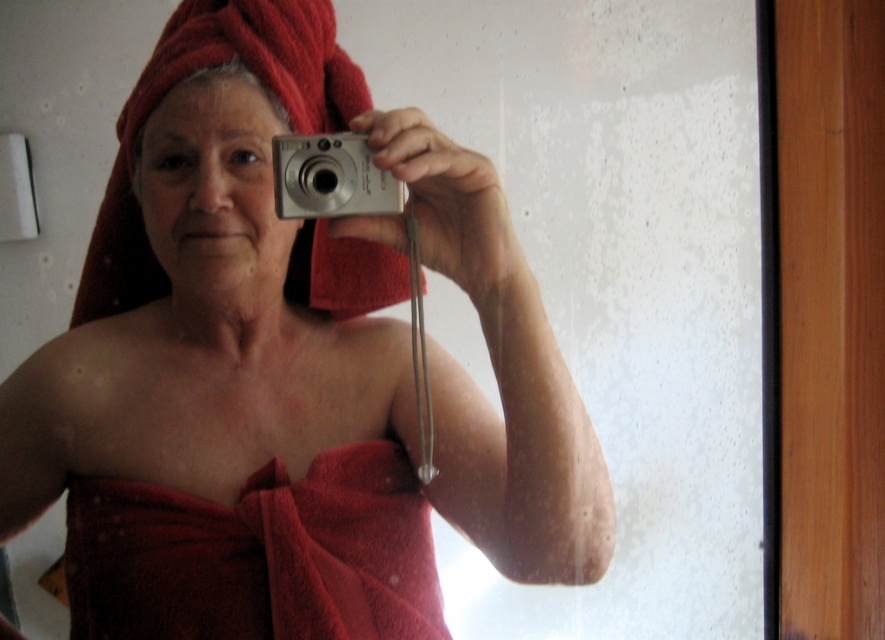
Between point (314, 481) and point (317, 157), which one is positioned behind?

The point (314, 481) is more distant.

Image resolution: width=885 pixels, height=640 pixels. I want to click on red towel at center, so click(x=258, y=556).

This screenshot has height=640, width=885. Find the location of `red towel at center`. red towel at center is located at coordinates (258, 556).

Looking at this image, does matte red towel at center have a lesser width compared to silver metallic camera at center?

Incorrect, matte red towel at center's width is not less than silver metallic camera at center's.

Where is `matte red towel at center`? This screenshot has height=640, width=885. matte red towel at center is located at coordinates (305, 356).

Is point (349, 456) in front of point (318, 195)?

No, it is not.

Where is `matte red towel at center`? matte red towel at center is located at coordinates coord(305,356).

Is the position of matte red towel at center more distant than that of red towel at center?

No.

Is matte red towel at center wider than red towel at center?

Correct, the width of matte red towel at center exceeds that of red towel at center.

The height and width of the screenshot is (640, 885). In order to click on matte red towel at center in this screenshot , I will do `click(305, 356)`.